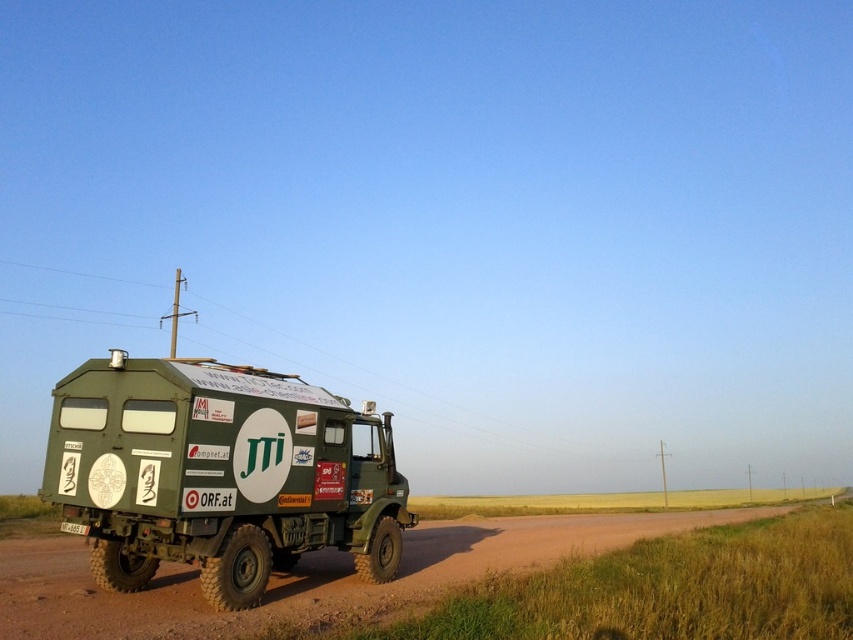
Question: Which object appears closest to the camera in this image?

Choices:
 (A) white plastic license plate at lower left
 (B) green matte truck at left

Answer: (B)

Question: Is green matte truck at left thinner than white plastic license plate at lower left?

Choices:
 (A) no
 (B) yes

Answer: (A)

Question: Can you confirm if green matte truck at left is positioned to the left of white plastic license plate at lower left?

Choices:
 (A) yes
 (B) no

Answer: (B)

Question: Which of the following is the closest to the observer?

Choices:
 (A) white plastic license plate at lower left
 (B) green matte truck at left

Answer: (B)

Question: Can you confirm if green matte truck at left is positioned below white plastic license plate at lower left?

Choices:
 (A) yes
 (B) no

Answer: (B)